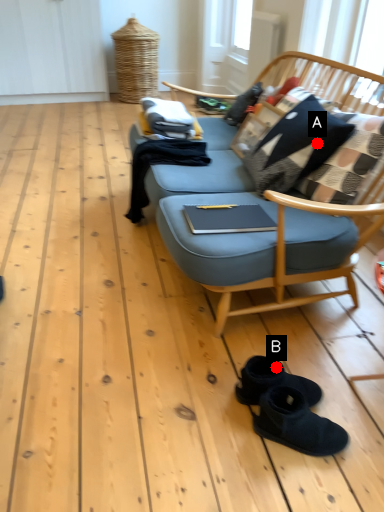
Question: Two points are circled on the image, labeled by A and B beside each circle. Which point is farther from the camera taking this photo?

Choices:
 (A) A is further
 (B) B is further

Answer: (A)